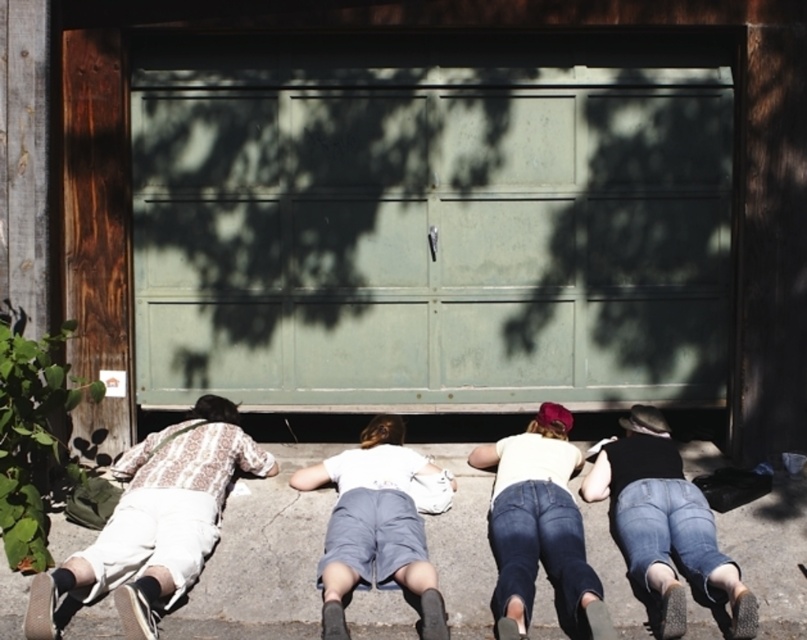
Question: Which of the following is the closest to the observer?

Choices:
 (A) (157, 525)
 (B) (377, 416)
 (C) (586, 518)

Answer: (A)

Question: Can you confirm if green painted metal at center is positioned to the left of white cotton shirt at center?

Choices:
 (A) no
 (B) yes

Answer: (A)

Question: Which is nearer to the denim jeans at center?

Choices:
 (A) white cotton shirt at left
 (B) green painted metal at center
 (C) gray concrete pavement at center
 (D) white cotton shirt at center

Answer: (D)

Question: Can you confirm if gray concrete pavement at center is positioned below white cotton shirt at center?

Choices:
 (A) no
 (B) yes

Answer: (B)

Question: Which point is closer to the camera?

Choices:
 (A) gray concrete pavement at center
 (B) white cotton shirt at left
 (C) white cotton shirt at center
 (D) green painted metal at center

Answer: (B)

Question: Does white cotton shirt at left have a larger size compared to denim jeans at center?

Choices:
 (A) no
 (B) yes

Answer: (B)